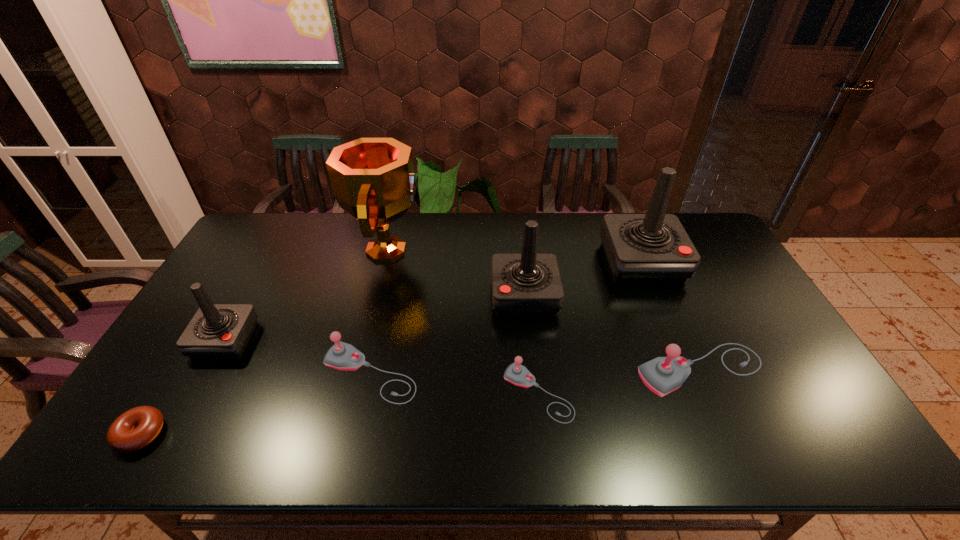
Locate an element on the screen. The image size is (960, 540). the second closest gray joystick to the biggest gray joystick is located at coordinates (342, 356).

Find the location of a particular element. vacant space that satisfies the following two spatial constraints: 1. on the front-facing side of the fifth shortest joystick; 2. on the back side of the biggest gray joystick is located at coordinates (532, 370).

Locate an element on the screen. This screenshot has width=960, height=540. free location that satisfies the following two spatial constraints: 1. on the front-facing side of the second biggest gray joystick; 2. on the left side of the smallest red joystick is located at coordinates (206, 374).

Find the location of a particular element. free location that satisfies the following two spatial constraints: 1. on the side of the gold award with the star emblem; 2. on the front-facing side of the fourth shortest joystick is located at coordinates (366, 340).

The image size is (960, 540). Identify the location of free space that satisfies the following two spatial constraints: 1. on the back side of the fourth shortest object; 2. on the right side of the second biggest gray joystick. (371, 370).

Identify the location of blank area in the image that satisfies the following two spatial constraints: 1. on the front-facing side of the smallest red joystick; 2. on the right side of the seventh tallest object. (196, 393).

Identify the location of free space that satisfies the following two spatial constraints: 1. on the side of the smallest gray joystick with the star emblem; 2. on the left side of the award. This screenshot has width=960, height=540. (352, 393).